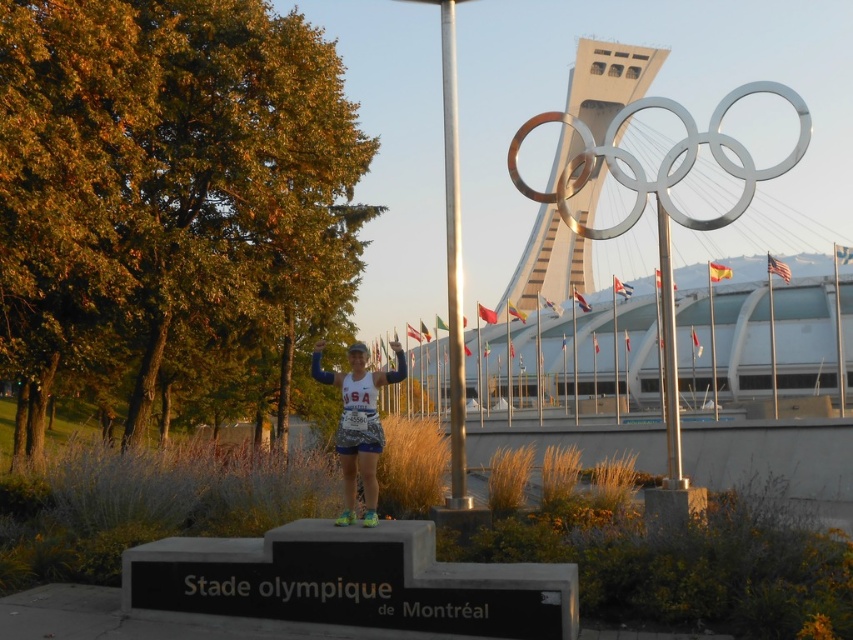
Question: Does metallic pole at center have a greater width compared to camouflage fabric running suit at center?

Choices:
 (A) yes
 (B) no

Answer: (B)

Question: Can you confirm if metallic pole at center is positioned above silver metallic pole at upper center?

Choices:
 (A) yes
 (B) no

Answer: (A)

Question: Which point appears farthest from the camera in this image?

Choices:
 (A) pos(363,412)
 (B) pos(459,417)

Answer: (B)

Question: Does metallic pole at center appear over silver metallic pole at upper center?

Choices:
 (A) yes
 (B) no

Answer: (A)

Question: Which of the following is the closest to the observer?

Choices:
 (A) (672, 301)
 (B) (462, 458)

Answer: (B)

Question: Which object is farther from the camera taking this photo?

Choices:
 (A) silver metallic pole at upper center
 (B) camouflage fabric running suit at center

Answer: (A)